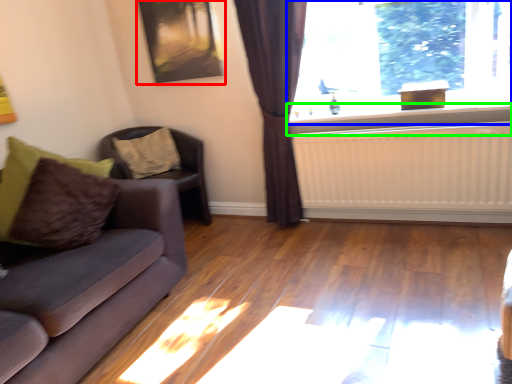
Question: Which object is positioned closest to picture frame (highlighted by a red box)? Select from window (highlighted by a blue box) and window sill (highlighted by a green box).

Choices:
 (A) window
 (B) window sill

Answer: (A)